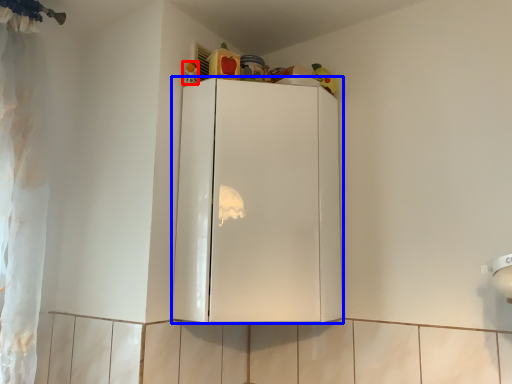
Question: Among these objects, which one is farthest to the camera, toy (highlighted by a red box) or cabinetry (highlighted by a blue box)?

Choices:
 (A) toy
 (B) cabinetry

Answer: (A)